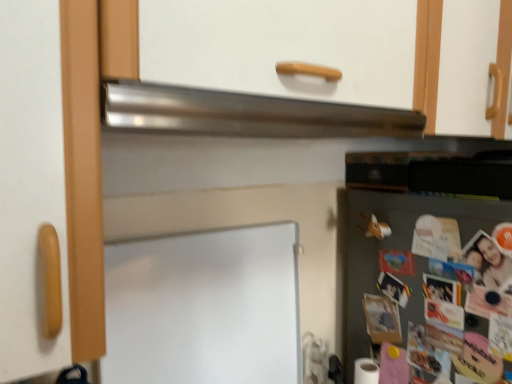
Describe the element at coordinates (246, 114) in the screenshot. I see `satin metallic exhaust hood at upper center` at that location.

Describe the element at coordinates (399, 252) in the screenshot. I see `green matte fridge at lower right` at that location.

Find the location of `satin metallic exhaust hood at upper center`. satin metallic exhaust hood at upper center is located at coordinates (246, 114).

From a real-world perspective, is white matte board at center over green matte fridge at lower right?

Correct, in the physical world, white matte board at center is higher than green matte fridge at lower right.

Would you say white matte board at center is inside or outside green matte fridge at lower right?

white matte board at center cannot be found inside green matte fridge at lower right.

Would you say white matte board at center is to the left or to the right of green matte fridge at lower right in the picture?

From the image, it's evident that white matte board at center is to the left of green matte fridge at lower right.

Is the depth of white matte board at center greater than that of green matte fridge at lower right?

No, white matte board at center is in front of green matte fridge at lower right.

At what (x,y) coordinates should I click in order to perform the action: click on fridge on the right of the satin metallic exhaust hood at upper center. Please return your answer as a coordinate pair (x, y). Image resolution: width=512 pixels, height=384 pixels. Looking at the image, I should click on (399, 252).

How distant is green matte fridge at lower right from satin metallic exhaust hood at upper center?

green matte fridge at lower right and satin metallic exhaust hood at upper center are 16.02 inches apart from each other.

Between point (351, 340) and point (141, 94), which one is positioned in front?

The point (141, 94) is in front.

In the image, is green matte fridge at lower right positioned in front of or behind satin metallic exhaust hood at upper center?

In the image, green matte fridge at lower right appears behind satin metallic exhaust hood at upper center.

From the image's perspective, is green matte fridge at lower right above or below white matte board at center?

green matte fridge at lower right is situated lower than white matte board at center in the image.

Is green matte fridge at lower right wider than white matte board at center?

Yes.

Locate an element on the screen. The image size is (512, 384). bulletin board to the left of green matte fridge at lower right is located at coordinates pyautogui.click(x=204, y=308).

Is green matte fridge at lower right inside the boundaries of white matte board at center, or outside?

The correct answer is: outside.

From the picture: From a real-world perspective, is white matte board at center positioned over satin metallic exhaust hood at upper center based on gravity?

Incorrect, from a real-world perspective, white matte board at center is lower than satin metallic exhaust hood at upper center.

Looking at this image, does white matte board at center appear on the left side of satin metallic exhaust hood at upper center?

Yes.

Considering the relative sizes of white matte board at center and satin metallic exhaust hood at upper center in the image provided, is white matte board at center taller than satin metallic exhaust hood at upper center?

Yes.

Where is `bulletin board lying on the left of satin metallic exhaust hood at upper center`? This screenshot has width=512, height=384. bulletin board lying on the left of satin metallic exhaust hood at upper center is located at coordinates (204, 308).

Based on the photo, is satin metallic exhaust hood at upper center taller or shorter than white matte board at center?

satin metallic exhaust hood at upper center is shorter than white matte board at center.

Is satin metallic exhaust hood at upper center bigger than white matte board at center?

No, satin metallic exhaust hood at upper center is not bigger than white matte board at center.

From the image's perspective, would you say satin metallic exhaust hood at upper center is shown under white matte board at center?

Actually, satin metallic exhaust hood at upper center appears above white matte board at center in the image.

How many degrees apart are the facing directions of satin metallic exhaust hood at upper center and white matte board at center?

The angle between the facing direction of satin metallic exhaust hood at upper center and the facing direction of white matte board at center is 1.79 degrees.

From a real-world perspective, between satin metallic exhaust hood at upper center and green matte fridge at lower right, who is vertically lower?

From a 3D spatial view, green matte fridge at lower right is below.

Is satin metallic exhaust hood at upper center wider than green matte fridge at lower right?

Incorrect, the width of satin metallic exhaust hood at upper center does not surpass that of green matte fridge at lower right.

Is satin metallic exhaust hood at upper center touching green matte fridge at lower right?

satin metallic exhaust hood at upper center and green matte fridge at lower right are clearly separated.

You are a GUI agent. You are given a task and a screenshot of the screen. Output one action in this format:
    pyautogui.click(x=<x>, y=<y>)
    Task: Click on the bulletin board above the green matte fridge at lower right (from a real-world perspective)
    
    Given the screenshot: What is the action you would take?
    pyautogui.click(x=204, y=308)

Where is `fridge behind the satin metallic exhaust hood at upper center`? The width and height of the screenshot is (512, 384). fridge behind the satin metallic exhaust hood at upper center is located at coordinates [x=399, y=252].

Based on the photo, from the image, which object appears to be farther from green matte fridge at lower right, satin metallic exhaust hood at upper center or white matte board at center?

Among the two, satin metallic exhaust hood at upper center is located further to green matte fridge at lower right.

From the image, which object appears to be nearer to white matte board at center, satin metallic exhaust hood at upper center or green matte fridge at lower right?

satin metallic exhaust hood at upper center lies closer to white matte board at center than the other object.

From the image, which object appears to be nearer to satin metallic exhaust hood at upper center, white matte board at center or green matte fridge at lower right?

white matte board at center is closer to satin metallic exhaust hood at upper center.

Considering their positions, is green matte fridge at lower right positioned closer to satin metallic exhaust hood at upper center than white matte board at center?

white matte board at center lies closer to satin metallic exhaust hood at upper center than the other object.

When comparing their distances from green matte fridge at lower right, does white matte board at center or satin metallic exhaust hood at upper center seem closer?

white matte board at center lies closer to green matte fridge at lower right than the other object.

In the scene shown: Looking at the image, which one is located closer to white matte board at center, green matte fridge at lower right or satin metallic exhaust hood at upper center?

satin metallic exhaust hood at upper center is positioned closer to the anchor white matte board at center.

Where is `exhaust hood situated between white matte board at center and green matte fridge at lower right from left to right`? The image size is (512, 384). exhaust hood situated between white matte board at center and green matte fridge at lower right from left to right is located at coordinates [x=246, y=114].